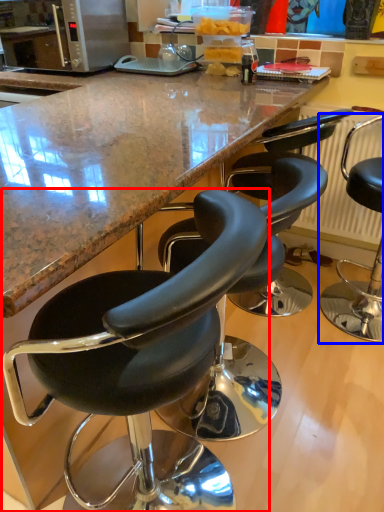
Question: Which object appears farthest to the camera in this image, chair (highlighted by a red box) or chair (highlighted by a blue box)?

Choices:
 (A) chair
 (B) chair

Answer: (B)